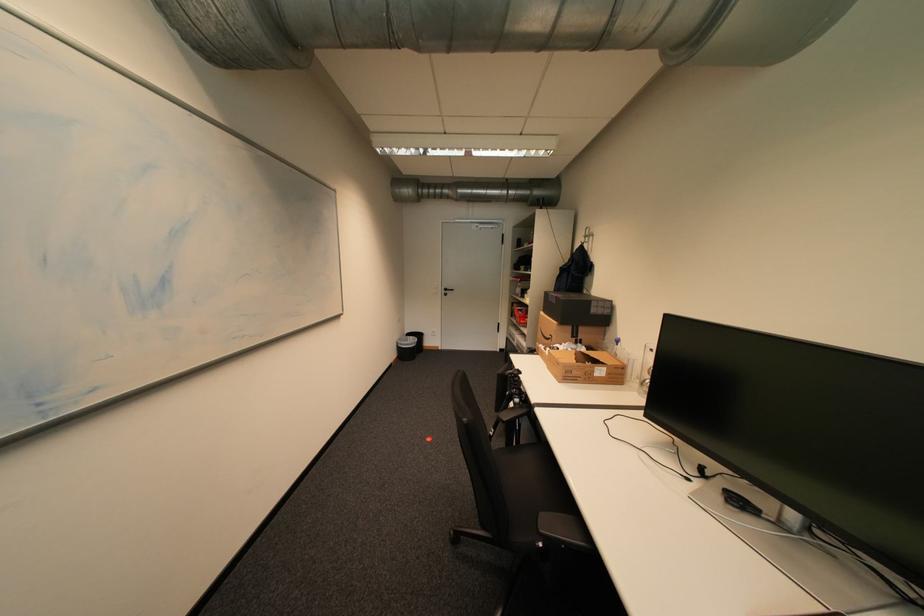
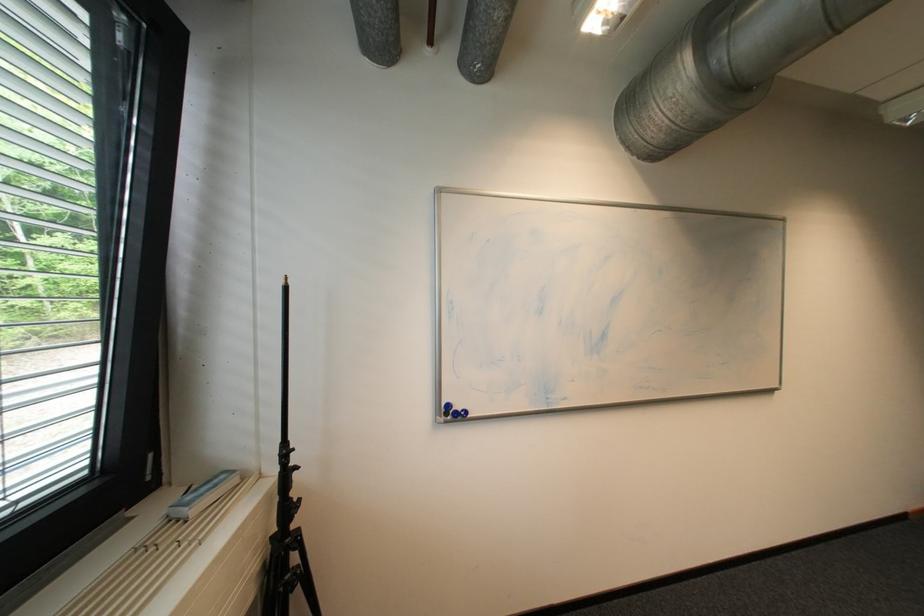
Question: Based on the continuous images, in which direction is the camera rotating? Reply with the corresponding letter.

Choices:
 (A) Left
 (B) Right
 (C) Up
 (D) Down

Answer: (A)